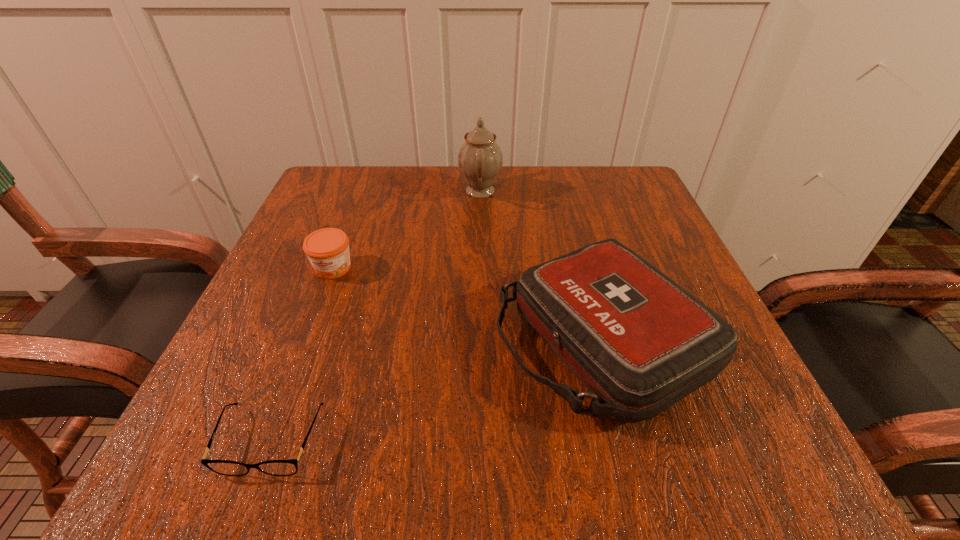
Identify the location of object at the far edge. The image size is (960, 540). (480, 159).

Locate an element on the screen. the first-aid kit located in the near edge section of the desktop is located at coordinates (638, 342).

The height and width of the screenshot is (540, 960). Identify the location of spectacles that is at the near edge. (223, 467).

Locate an element on the screen. The image size is (960, 540). jam that is at the left edge is located at coordinates pos(327,249).

Where is `spectacles at the left edge`? spectacles at the left edge is located at coordinates (223, 467).

Find the location of a particular element. object positioned at the right edge is located at coordinates (638, 342).

Find the location of a particular element. This screenshot has width=960, height=540. object that is at the near left corner is located at coordinates (223, 467).

Locate an element on the screen. This screenshot has width=960, height=540. object that is at the near right corner is located at coordinates (638, 342).

This screenshot has width=960, height=540. Identify the location of vacant space at the far edge of the desktop. (417, 188).

Locate an element on the screen. This screenshot has height=540, width=960. free space at the near edge of the desktop is located at coordinates (516, 454).